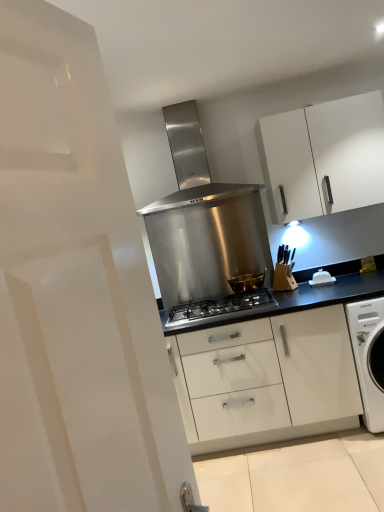
Question: Considering their positions, is stainless steel gas stove at center located in front of or behind white matte cabinet at upper right?

Choices:
 (A) front
 (B) behind

Answer: (A)

Question: Which is correct: stainless steel gas stove at center is inside white matte cabinet at upper right, or outside of it?

Choices:
 (A) outside
 (B) inside

Answer: (A)

Question: Estimate the real-world distances between objects in this image. Which object is farther from the white matte cabinet at upper right?

Choices:
 (A) white plastic butter dish at center-right
 (B) stainless steel gas stove at center
 (C) stainless steel range hood at center
 (D) gold metallic bowl at center

Answer: (B)

Question: Estimate the real-world distances between objects in this image. Which object is farther from the stainless steel gas stove at center?

Choices:
 (A) gold metallic bowl at center
 (B) white plastic butter dish at center-right
 (C) white matte cabinet at upper right
 (D) stainless steel range hood at center

Answer: (C)